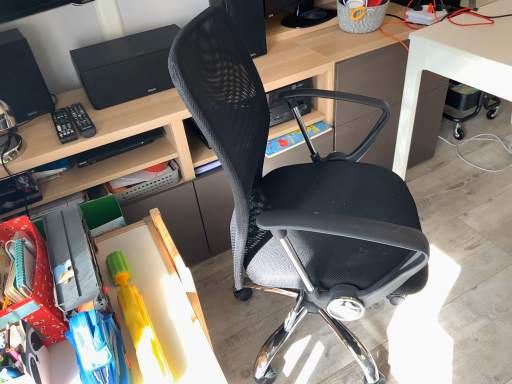
Where is `vacant point to the right of rubber yellow toy at lower left`? vacant point to the right of rubber yellow toy at lower left is located at coordinates point(172,302).